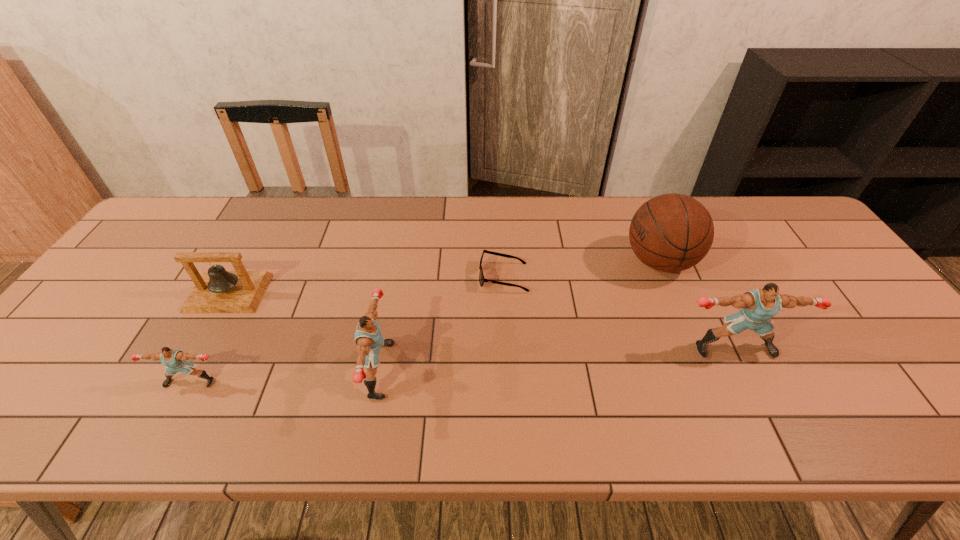
Find the location of a particular element. The height and width of the screenshot is (540, 960). free space for an extra puncher to achieve even spacing is located at coordinates (560, 359).